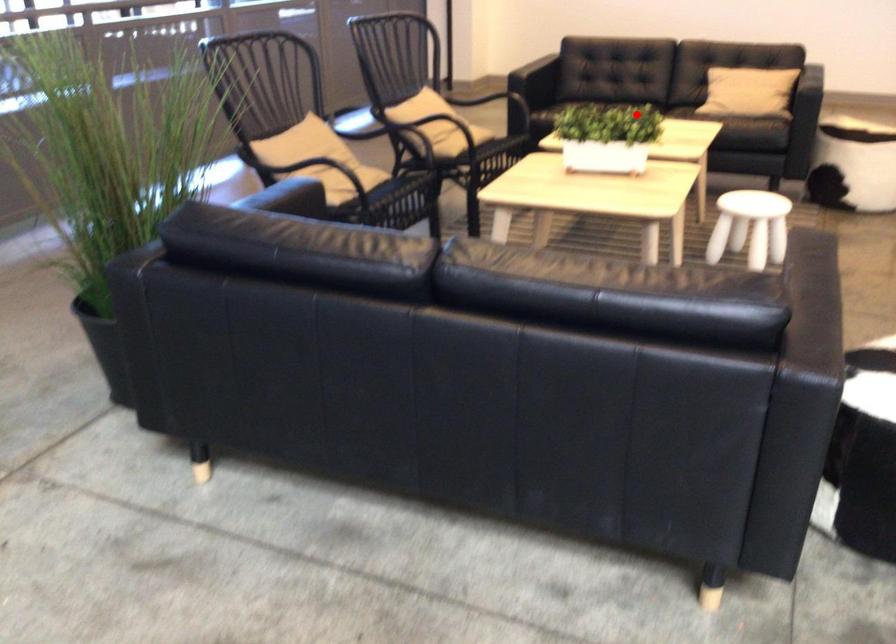
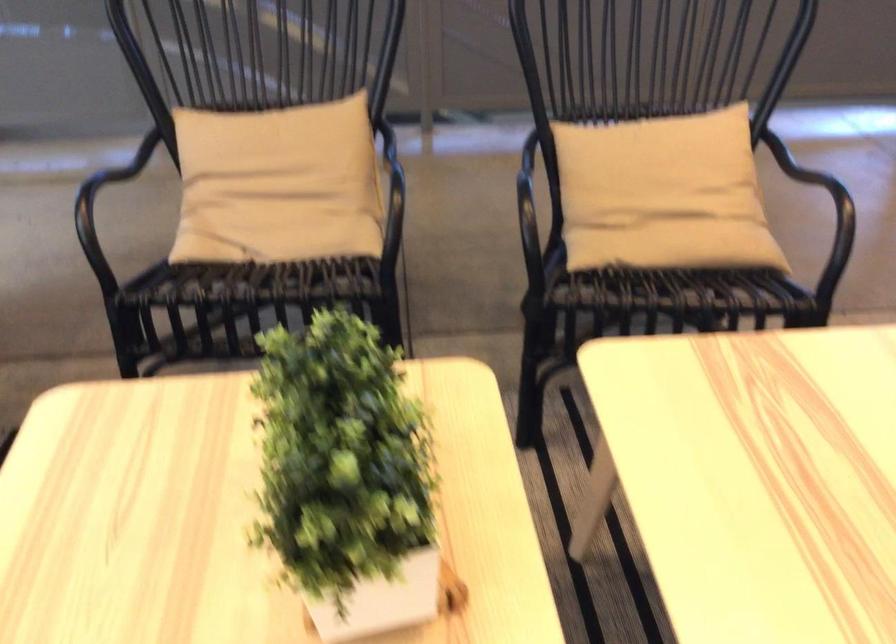
Question: I am providing you with two images of the same scene from different viewpoints. In image1, a red point is highlighted. Considering the same 3D point in image2, which of the following is correct?

Choices:
 (A) It is closer
 (B) It is farther

Answer: (A)